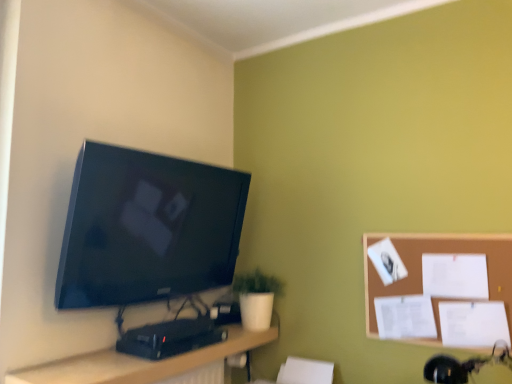
Question: Is wooden desk at lower center situated inside white matte pot at lower center or outside?

Choices:
 (A) inside
 (B) outside

Answer: (B)

Question: Looking at their shapes, would you say wooden desk at lower center is wider or thinner than white matte pot at lower center?

Choices:
 (A) wide
 (B) thin

Answer: (B)

Question: Which object is positioned farthest from the wooden desk at lower center?

Choices:
 (A) white matte pot at lower center
 (B) matte black tv at upper left
 (C) brown corkboard at right

Answer: (C)

Question: Which object is positioned closest to the brown corkboard at right?

Choices:
 (A) matte black tv at upper left
 (B) white matte pot at lower center
 (C) wooden desk at lower center

Answer: (B)